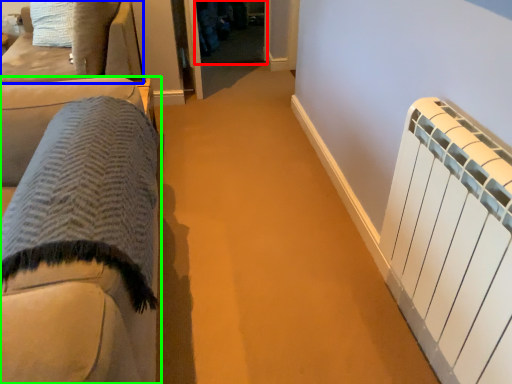
Question: Which object is the closest to the glass door (highlighted by a red box)? Choose among these: furniture (highlighted by a blue box) or furniture (highlighted by a green box).

Choices:
 (A) furniture
 (B) furniture

Answer: (A)